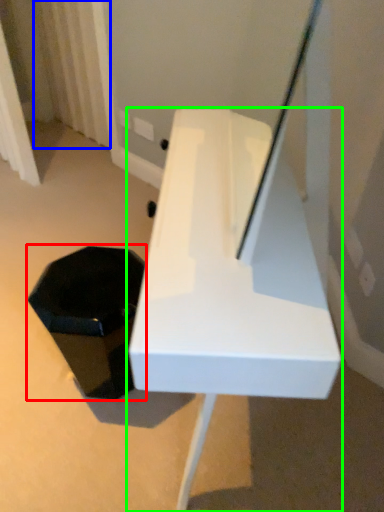
Question: Which object is positioned farthest from storage box (highlighted by a red box)? Select from curtain (highlighted by a blue box) and furniture (highlighted by a green box).

Choices:
 (A) curtain
 (B) furniture

Answer: (A)